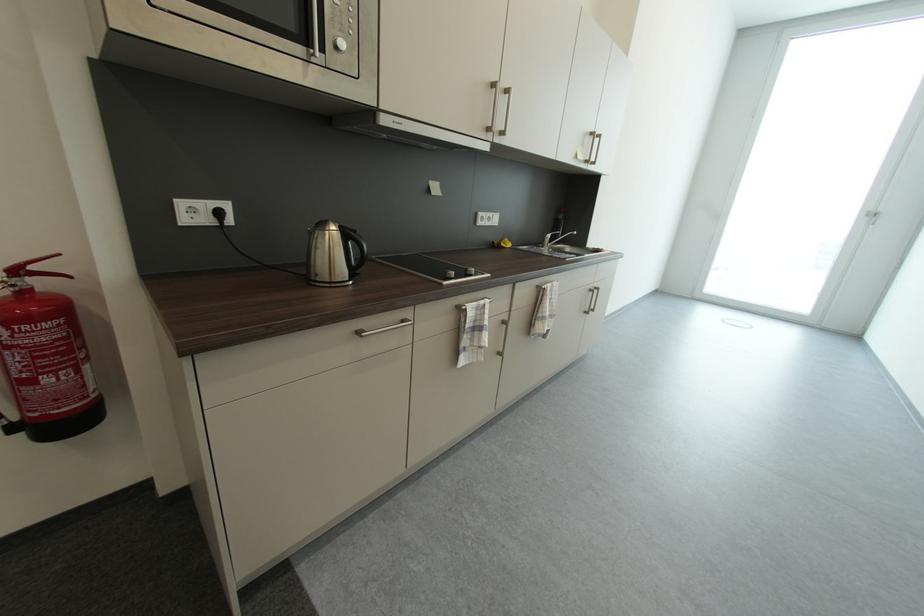
The width and height of the screenshot is (924, 616). In order to click on faucet handle in this screenshot , I will do `click(562, 237)`.